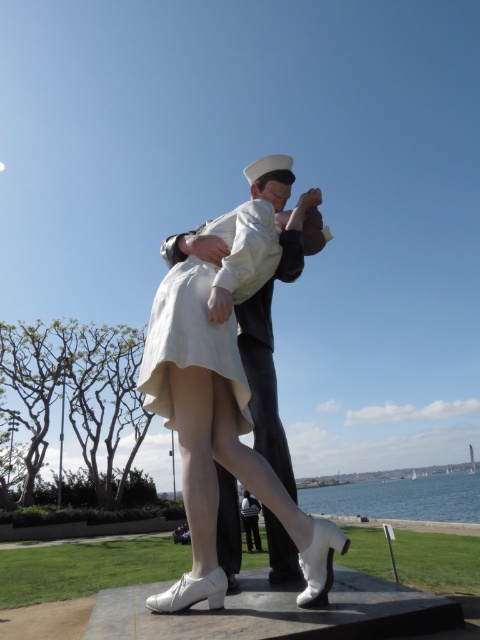
Question: Based on their relative distances, which object is nearer to the white satin dress at center?

Choices:
 (A) blue water at lower center
 (B) white glossy statue at center

Answer: (B)

Question: Estimate the real-world distances between objects in this image. Which object is farther from the white glossy statue at center?

Choices:
 (A) blue water at lower center
 (B) white satin dress at center

Answer: (A)

Question: Does white glossy statue at center have a lesser width compared to white satin dress at center?

Choices:
 (A) yes
 (B) no

Answer: (B)

Question: Is white glossy statue at center below white satin dress at center?

Choices:
 (A) yes
 (B) no

Answer: (A)

Question: Considering the real-world distances, which object is farthest from the white glossy statue at center?

Choices:
 (A) blue water at lower center
 (B) white satin dress at center

Answer: (A)

Question: Is white glossy statue at center to the right of blue water at lower center from the viewer's perspective?

Choices:
 (A) yes
 (B) no

Answer: (B)